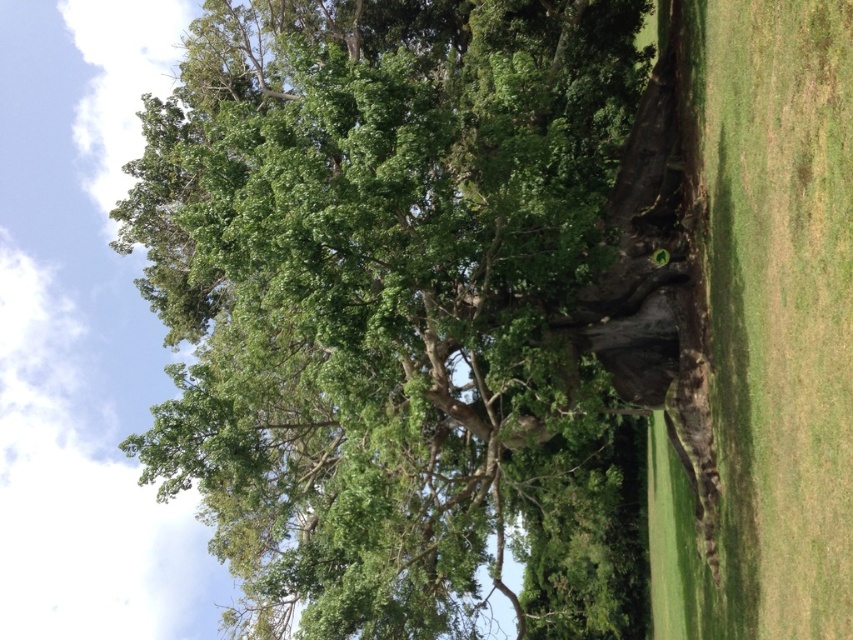
Question: Which of the following is the closest to the observer?

Choices:
 (A) (653, 465)
 (B) (498, 225)

Answer: (B)

Question: Does green leafy tree at center appear over green grass at right?

Choices:
 (A) yes
 (B) no

Answer: (B)

Question: Which point is farther to the camera?

Choices:
 (A) green grass at right
 (B) green leafy tree at center

Answer: (B)

Question: Can you confirm if green leafy tree at center is bigger than green grass at right?

Choices:
 (A) yes
 (B) no

Answer: (A)

Question: Where is green leafy tree at center located in relation to green grass at right in the image?

Choices:
 (A) above
 (B) below

Answer: (B)